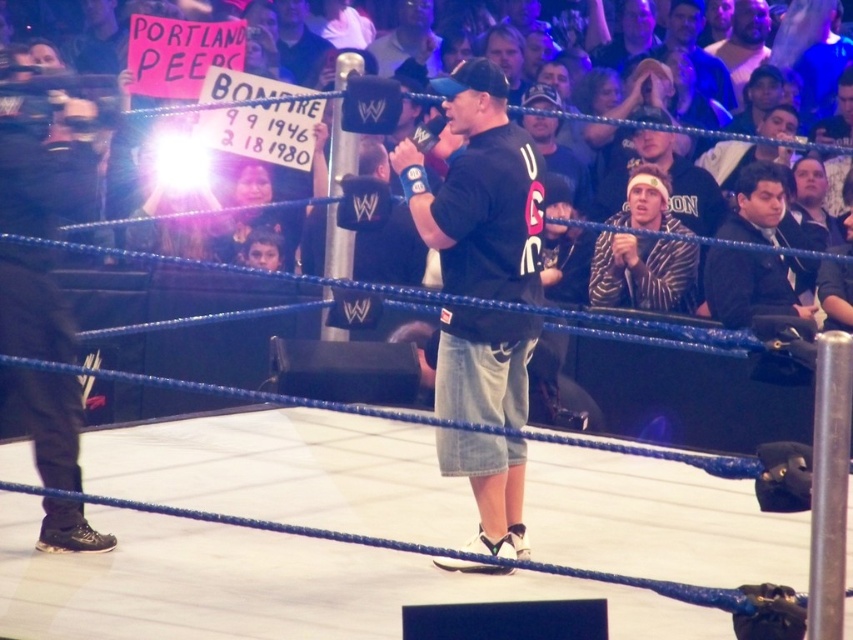
Question: Can you confirm if black denim shorts at center is positioned below black suit at right?

Choices:
 (A) yes
 (B) no

Answer: (A)

Question: Which of the following is the closest to the observer?

Choices:
 (A) (503, 170)
 (B) (692, 250)

Answer: (A)

Question: Observing the image, what is the correct spatial positioning of black denim shorts at center in reference to black suit at right?

Choices:
 (A) above
 (B) below

Answer: (B)

Question: Which object appears closest to the camera in this image?

Choices:
 (A) black suit at right
 (B) black denim shorts at center
 (C) striped hoodie at upper right

Answer: (B)

Question: Does black denim shorts at center appear over striped hoodie at upper right?

Choices:
 (A) yes
 (B) no

Answer: (B)

Question: Which point is closer to the camera?

Choices:
 (A) black suit at right
 (B) striped hoodie at upper right
 (C) black denim shorts at center

Answer: (C)